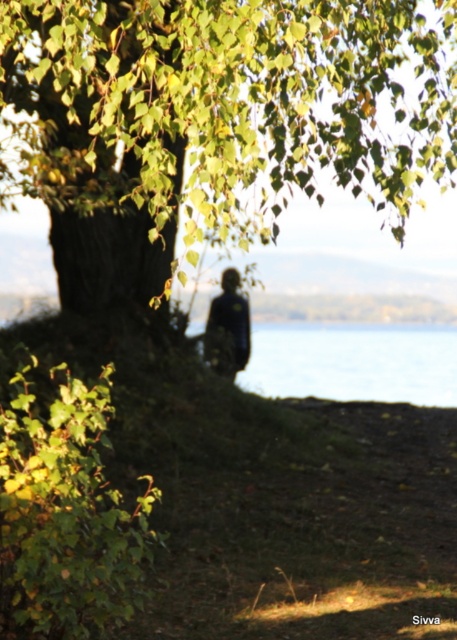
Who is lower down, green leafy tree at upper left or dark blue fabric at center?

Positioned lower is dark blue fabric at center.

Can you confirm if green leafy tree at upper left is positioned above dark blue fabric at center?

Yes.

Is point (425, 120) in front of point (239, 301)?

That is True.

Find the location of a particular element. The image size is (457, 640). green leafy tree at upper left is located at coordinates (213, 120).

Does transparent water at center have a greater height compared to dark blue fabric at center?

Incorrect, transparent water at center's height is not larger of dark blue fabric at center's.

Is transparent water at center below dark blue fabric at center?

Indeed, transparent water at center is positioned under dark blue fabric at center.

Does point (298, 342) lie behind point (242, 353)?

Yes, it is behind point (242, 353).

Identify the location of transparent water at center. (354, 362).

Can you confirm if green leafy tree at upper left is positioned above transparent water at center?

Yes.

Is green leafy tree at upper left wider than transparent water at center?

Incorrect, green leafy tree at upper left's width does not surpass transparent water at center's.

Is point (334, 13) more distant than point (384, 364)?

That is False.

This screenshot has height=640, width=457. I want to click on green leafy tree at upper left, so pos(213,120).